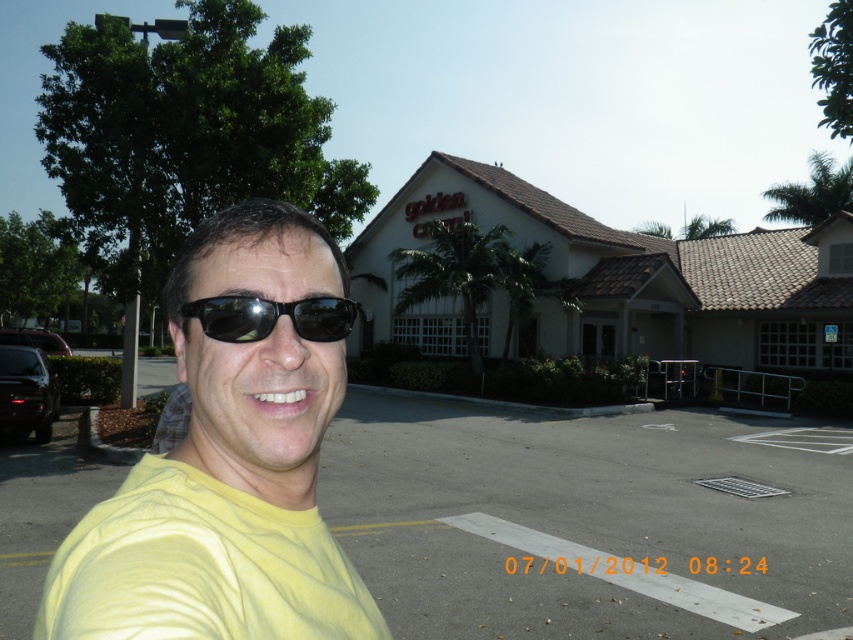
Question: From the image, what is the correct spatial relationship of gray asphalt parking lot at center in relation to yellow matte shirt at center?

Choices:
 (A) below
 (B) above

Answer: (A)

Question: Observing the image, what is the correct spatial positioning of gray asphalt parking lot at center in reference to yellow matte shirt at center?

Choices:
 (A) above
 (B) below

Answer: (B)

Question: Which object appears farthest from the camera in this image?

Choices:
 (A) yellow matte shirt at center
 (B) gray asphalt parking lot at center

Answer: (B)

Question: Which point is closer to the camera?

Choices:
 (A) yellow matte shirt at center
 (B) gray asphalt parking lot at center
 (C) black matte sunglasses at center

Answer: (A)

Question: Does gray asphalt parking lot at center appear on the left side of black matte sunglasses at center?

Choices:
 (A) no
 (B) yes

Answer: (A)

Question: Which of the following is the farthest from the observer?

Choices:
 (A) (260, 298)
 (B) (556, 474)

Answer: (B)